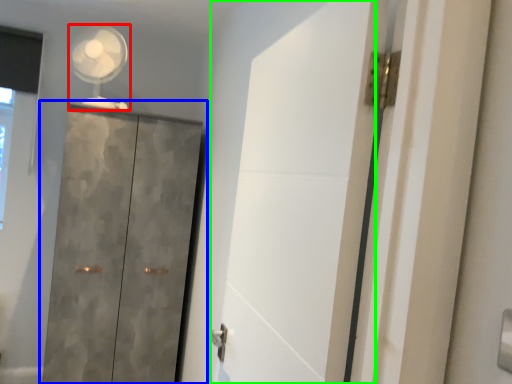
Question: Which object is the farthest from mechanical fan (highlighted by a red box)? Choose among these: cupboard (highlighted by a blue box) or screen door (highlighted by a green box).

Choices:
 (A) cupboard
 (B) screen door

Answer: (B)